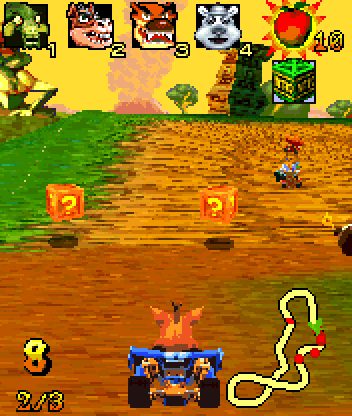
In order to click on box in this screenshot , I will do `click(292, 81)`, `click(210, 204)`, `click(68, 205)`.